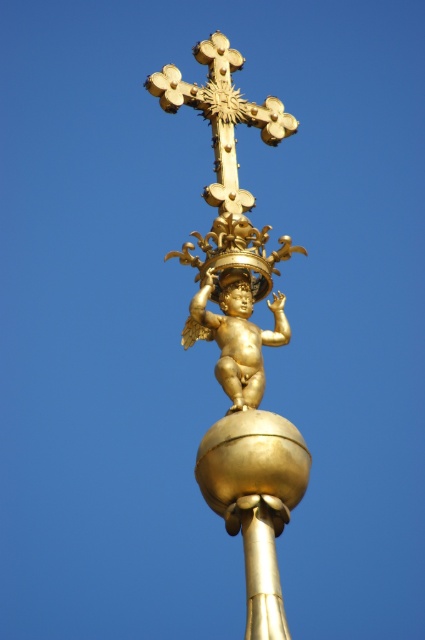
Question: Does gold polished cherub at center appear over gold metallic cherub at center?

Choices:
 (A) yes
 (B) no

Answer: (B)

Question: Is gold polished cherub at center further to the viewer compared to gold metallic cherub at center?

Choices:
 (A) yes
 (B) no

Answer: (B)

Question: Does gold polished cherub at center have a smaller size compared to gold metallic cherub at center?

Choices:
 (A) no
 (B) yes

Answer: (A)

Question: Which object is the farthest from the gold polished pole at center?

Choices:
 (A) gold polished cherub at center
 (B) gold polished crucifix at upper center

Answer: (B)

Question: Among these objects, which one is farthest from the camera?

Choices:
 (A) gold metallic cherub at center
 (B) gold polished crucifix at upper center

Answer: (B)

Question: Which point is closer to the camera taking this photo?

Choices:
 (A) (278, 122)
 (B) (248, 518)

Answer: (B)